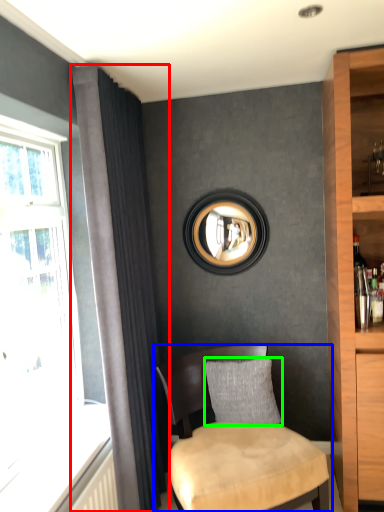
Question: Considering the real-world distances, which object is closest to curtain (highlighted by a red box)? chair (highlighted by a blue box) or pillow (highlighted by a green box).

Choices:
 (A) chair
 (B) pillow

Answer: (A)